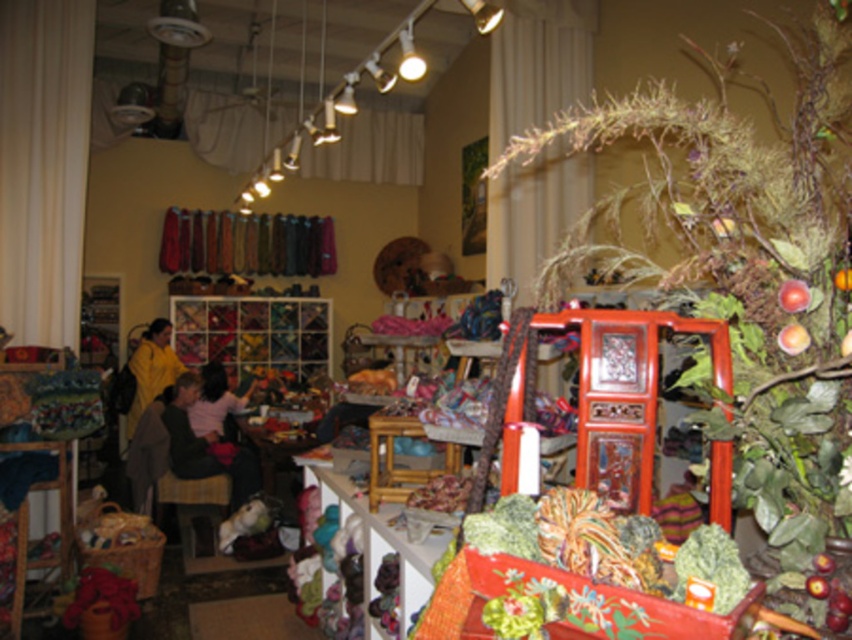
Question: Does bamboo stool at center lie behind yellow fabric at left?

Choices:
 (A) no
 (B) yes

Answer: (A)

Question: Can you confirm if bamboo stool at center is wider than yellow fabric at left?

Choices:
 (A) no
 (B) yes

Answer: (A)

Question: Which point is closer to the camera?

Choices:
 (A) (222, 396)
 (B) (220, 438)
 (C) (415, 426)

Answer: (C)

Question: Which point appears closest to the camera in this image?

Choices:
 (A) (217, 385)
 (B) (177, 470)

Answer: (B)

Question: Does dark gray sweater at center have a larger size compared to yellow fabric at left?

Choices:
 (A) no
 (B) yes

Answer: (A)

Question: Which point appears farthest from the camera in this image?

Choices:
 (A) (394, 435)
 (B) (208, 417)

Answer: (B)